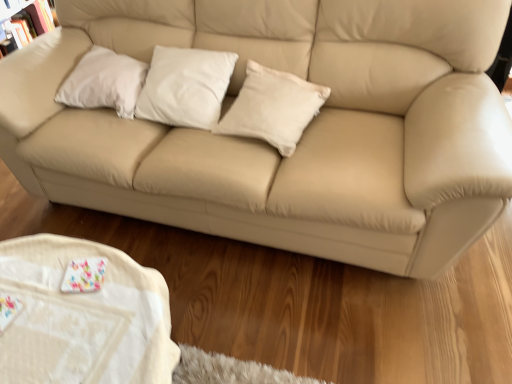
Question: Is beige leather couch at center to the right of white fabric table at lower left from the viewer's perspective?

Choices:
 (A) no
 (B) yes

Answer: (B)

Question: Is beige leather couch at center further to camera compared to white fabric table at lower left?

Choices:
 (A) no
 (B) yes

Answer: (B)

Question: Does beige leather couch at center have a lesser width compared to white fabric table at lower left?

Choices:
 (A) yes
 (B) no

Answer: (B)

Question: From a real-world perspective, is beige leather couch at center beneath white fabric table at lower left?

Choices:
 (A) no
 (B) yes

Answer: (A)

Question: Does beige leather couch at center have a smaller size compared to white fabric table at lower left?

Choices:
 (A) yes
 (B) no

Answer: (B)

Question: Considering the positions of beige leather couch at center and white matte pillow at upper left, which ranks as the 1th pillow in left-to-right order, in the image, is beige leather couch at center taller or shorter than white matte pillow at upper left, which ranks as the 1th pillow in left-to-right order,?

Choices:
 (A) short
 (B) tall

Answer: (B)

Question: Considering their positions, is beige leather couch at center located in front of or behind white matte pillow at upper left, which ranks as the 1th pillow in left-to-right order?

Choices:
 (A) behind
 (B) front

Answer: (B)

Question: Is beige leather couch at center bigger or smaller than white matte pillow at upper left, which ranks as the 1th pillow in left-to-right order?

Choices:
 (A) small
 (B) big

Answer: (B)

Question: Is beige leather couch at center wider or thinner than white matte pillow at upper left, which ranks as the third pillow in right-to-left order?

Choices:
 (A) thin
 (B) wide

Answer: (B)

Question: Relative to white matte pillow at upper left, which ranks as the 1th pillow in left-to-right order, is white fabric table at lower left in front or behind?

Choices:
 (A) behind
 (B) front

Answer: (B)

Question: Is white fabric table at lower left spatially inside white matte pillow at upper left, which ranks as the 1th pillow in left-to-right order, or outside of it?

Choices:
 (A) inside
 (B) outside

Answer: (B)

Question: Does point (57, 292) appear closer or farther from the camera than point (114, 62)?

Choices:
 (A) closer
 (B) farther

Answer: (A)

Question: From a real-world perspective, relative to white matte pillow at upper left, which ranks as the 1th pillow in left-to-right order, is white fabric table at lower left vertically above or below?

Choices:
 (A) above
 (B) below

Answer: (B)

Question: From the image's perspective, is white cotton pillow at center, which is counted as the first pillow, starting from the right, above or below white matte pillow at upper left, which ranks as the 1th pillow in left-to-right order?

Choices:
 (A) above
 (B) below

Answer: (B)

Question: Looking at the image, does white cotton pillow at center, which is counted as the first pillow, starting from the right, seem bigger or smaller compared to white matte pillow at upper left, which ranks as the 1th pillow in left-to-right order?

Choices:
 (A) small
 (B) big

Answer: (B)